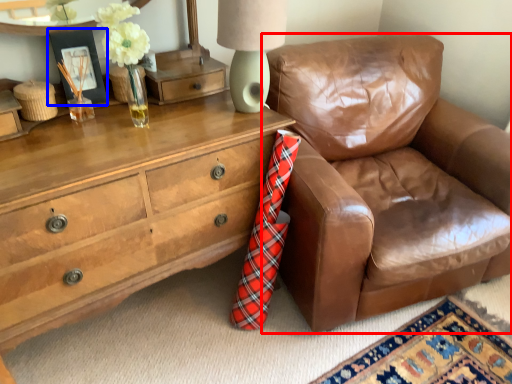
Question: Among these objects, which one is farthest to the camera, chair (highlighted by a red box) or picture frame (highlighted by a blue box)?

Choices:
 (A) chair
 (B) picture frame

Answer: (B)